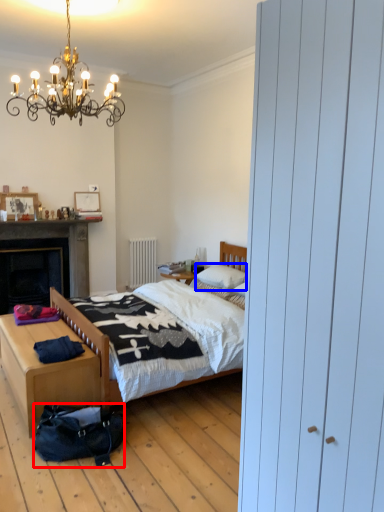
Question: Which of the following is the farthest to the observer, bag (highlighted by a red box) or pillow (highlighted by a blue box)?

Choices:
 (A) bag
 (B) pillow

Answer: (B)